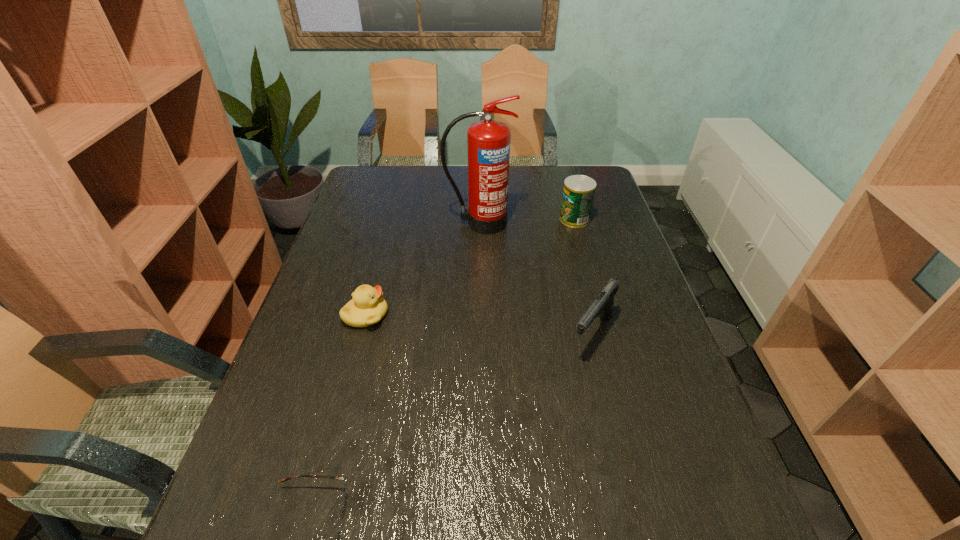
The width and height of the screenshot is (960, 540). I want to click on fire extinguisher, so click(x=488, y=141).

What are the coordinates of `the tallest object` in the screenshot? It's located at (488, 141).

I want to click on can, so click(578, 194).

I want to click on gun, so click(x=603, y=305).

Locate an element on the screen. The height and width of the screenshot is (540, 960). the fourth tallest object is located at coordinates (367, 307).

At what (x,y) coordinates should I click in order to perform the action: click on free space located on the surface of the third object from right to left. Please return your answer as a coordinate pair (x, y). This screenshot has height=540, width=960. Looking at the image, I should click on (479, 272).

At what (x,y) coordinates should I click in order to perform the action: click on vacant space situated 0.170m on the front of the can. Please return your answer as a coordinate pair (x, y). The width and height of the screenshot is (960, 540). Looking at the image, I should click on (586, 261).

Locate an element on the screen. The width and height of the screenshot is (960, 540). vacant area situated at the muzzle of the gun is located at coordinates (607, 393).

Find the location of `free space located 0.370m on the beak of the duckling`. free space located 0.370m on the beak of the duckling is located at coordinates (530, 315).

At what (x,y) coordinates should I click in order to perform the action: click on object present at the left edge. Please return your answer as a coordinate pair (x, y). The image size is (960, 540). Looking at the image, I should click on (367, 307).